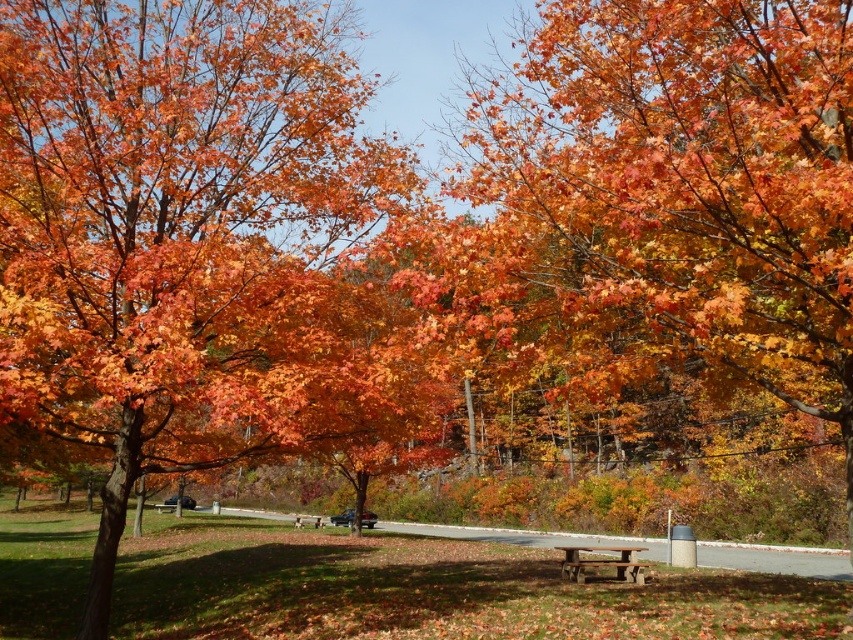
Question: Does orange autumn leaves at center have a larger size compared to rustic wood picnic table at center?

Choices:
 (A) yes
 (B) no

Answer: (A)

Question: Which of the following is the farthest from the observer?

Choices:
 (A) rustic wood picnic table at center
 (B) orange autumn leaves at center

Answer: (A)

Question: Which object is farther from the camera taking this photo?

Choices:
 (A) rustic wood picnic table at center
 (B) orange autumn leaves at center

Answer: (A)

Question: Which point is farther to the camera?

Choices:
 (A) rustic wood picnic table at center
 (B) orange autumn leaves at center

Answer: (A)

Question: Does orange autumn leaves at center appear on the left side of rustic wood picnic table at center?

Choices:
 (A) no
 (B) yes

Answer: (B)

Question: From the image, what is the correct spatial relationship of orange autumn leaves at center in relation to rustic wood picnic table at center?

Choices:
 (A) below
 (B) above

Answer: (B)